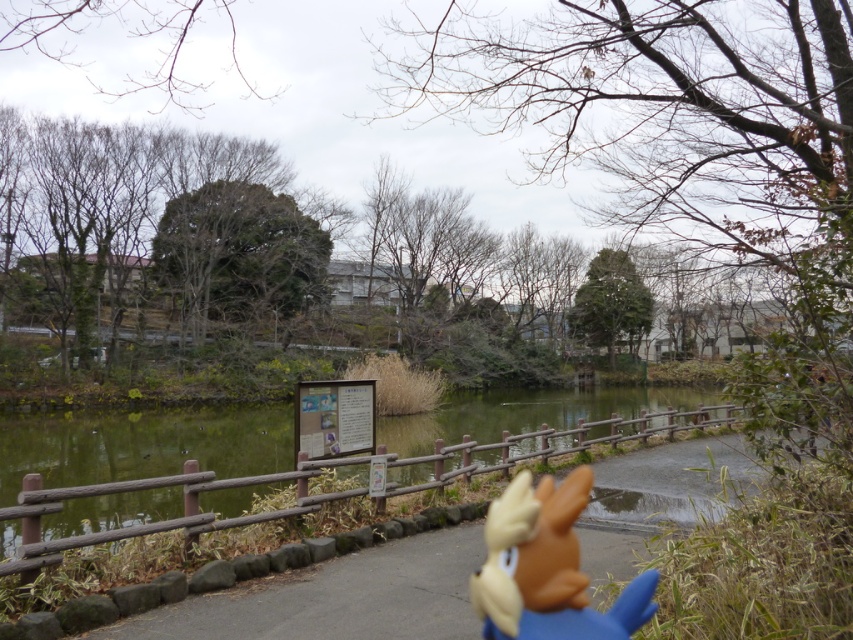
Question: Which point is farther to the camera?

Choices:
 (A) green wooden fence at center
 (B) brown matte doll at lower center

Answer: (A)

Question: Is green wooden fence at center further to camera compared to brown matte doll at lower center?

Choices:
 (A) yes
 (B) no

Answer: (A)

Question: Is green wooden fence at center wider than brown matte doll at lower center?

Choices:
 (A) no
 (B) yes

Answer: (B)

Question: Can you confirm if green wooden fence at center is positioned below brown matte doll at lower center?

Choices:
 (A) yes
 (B) no

Answer: (A)